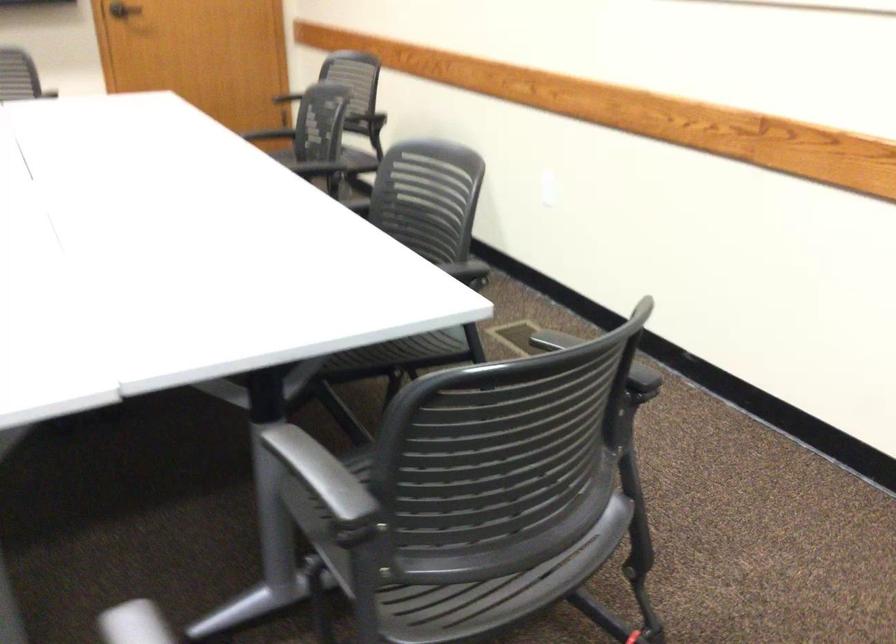
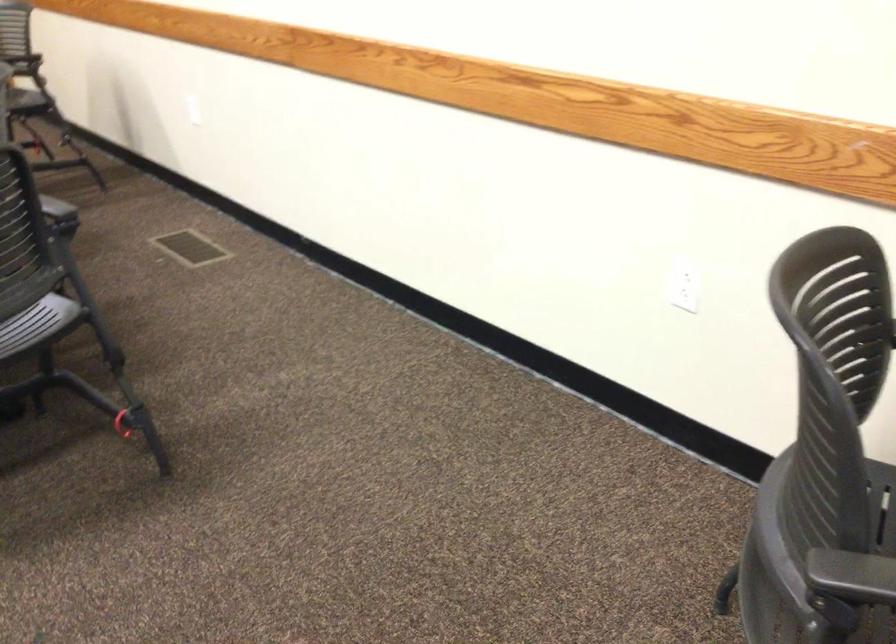
Where in the second image is the point corresponding to pixel 537 526 from the first image?

(37, 323)